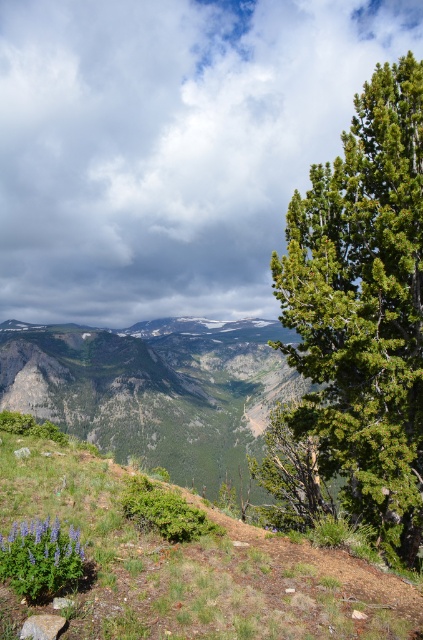
From the picture: Is green textured tree at right thinner than green grassy hillside at center?

Correct, green textured tree at right's width is less than green grassy hillside at center's.

Does green textured tree at right have a smaller size compared to green grassy hillside at center?

Indeed, green textured tree at right has a smaller size compared to green grassy hillside at center.

Between point (337, 224) and point (145, 385), which one is positioned behind?

The point (145, 385) is behind.

Identify the location of green textured tree at right. This screenshot has width=423, height=640. (364, 308).

Is green grassy at lower left below green grassy hillside at center?

Incorrect, green grassy at lower left is not positioned below green grassy hillside at center.

Is point (57, 456) less distant than point (137, 384)?

Yes, point (57, 456) is closer to viewer.

You are a GUI agent. You are given a task and a screenshot of the screen. Output one action in this format:
    pyautogui.click(x=<x>, y=<y>)
    Task: Click on the green grassy at lower left
    The width and height of the screenshot is (423, 640).
    Given the screenshot: What is the action you would take?
    pyautogui.click(x=189, y=566)

Does point (35, 333) lie in front of point (43, 522)?

No.

Which is in front, point (121, 376) or point (24, 525)?

Point (24, 525) is more forward.

Which is behind, point (159, 346) or point (35, 547)?

Point (159, 346)

This screenshot has width=423, height=640. Find the location of `green grassy hillside at center`. green grassy hillside at center is located at coordinates 154,388.